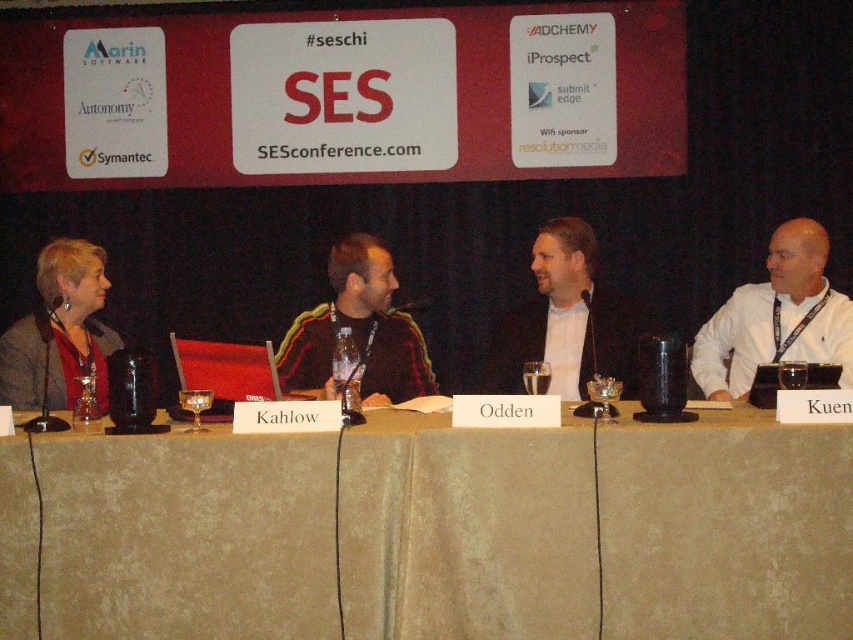
Consider the image. Based on the scene description, where is the matte black suit at center located in terms of its 2D coordinates?

The matte black suit at center is located at the 2D coordinates point (567, 321).

You are attending the SES conference and want to introduce yourself to the panelist wearing the matte black jacket at left. Where should you stand relative to the white shirt at right to approach them?

You should stand to the left of the white shirt at right because the matte black jacket at left is behind the white shirt at right, so approaching from the left side of the white shirt at right will lead you to the matte black jacket at left.